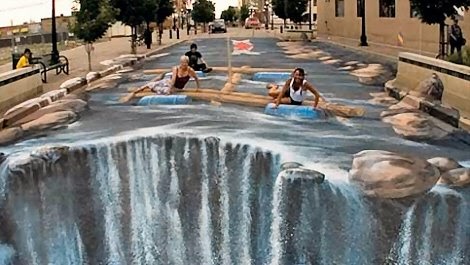
Where is `bench`? This screenshot has height=265, width=470. bench is located at coordinates [x=49, y=62].